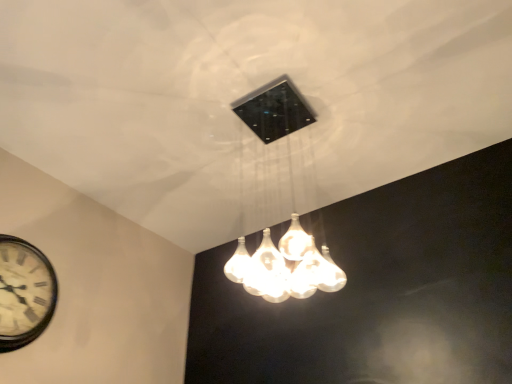
Question: Does translucent glass chandelier at center contain white wooden clock at lower left?

Choices:
 (A) yes
 (B) no

Answer: (B)

Question: From a real-world perspective, is translucent glass chandelier at center located beneath white wooden clock at lower left?

Choices:
 (A) no
 (B) yes

Answer: (A)

Question: Is translucent glass chandelier at center positioned with its back to white wooden clock at lower left?

Choices:
 (A) no
 (B) yes

Answer: (A)

Question: Is translucent glass chandelier at center located outside white wooden clock at lower left?

Choices:
 (A) no
 (B) yes

Answer: (B)

Question: Could you tell me if translucent glass chandelier at center is turned towards white wooden clock at lower left?

Choices:
 (A) no
 (B) yes

Answer: (A)

Question: Would you consider translucent glass chandelier at center to be distant from white wooden clock at lower left?

Choices:
 (A) no
 (B) yes

Answer: (B)

Question: Is white wooden clock at lower left turned away from translucent glass chandelier at center?

Choices:
 (A) no
 (B) yes

Answer: (A)

Question: Is white wooden clock at lower left touching translucent glass chandelier at center?

Choices:
 (A) yes
 (B) no

Answer: (B)

Question: From a real-world perspective, is white wooden clock at lower left positioned under translucent glass chandelier at center based on gravity?

Choices:
 (A) no
 (B) yes

Answer: (B)

Question: From the image's perspective, does white wooden clock at lower left appear lower than translucent glass chandelier at center?

Choices:
 (A) no
 (B) yes

Answer: (B)

Question: From a real-world perspective, is white wooden clock at lower left located higher than translucent glass chandelier at center?

Choices:
 (A) no
 (B) yes

Answer: (A)

Question: Could you tell me if white wooden clock at lower left is turned towards translucent glass chandelier at center?

Choices:
 (A) no
 (B) yes

Answer: (B)

Question: Would you say translucent glass chandelier at center is to the left or to the right of white wooden clock at lower left in the picture?

Choices:
 (A) left
 (B) right

Answer: (B)